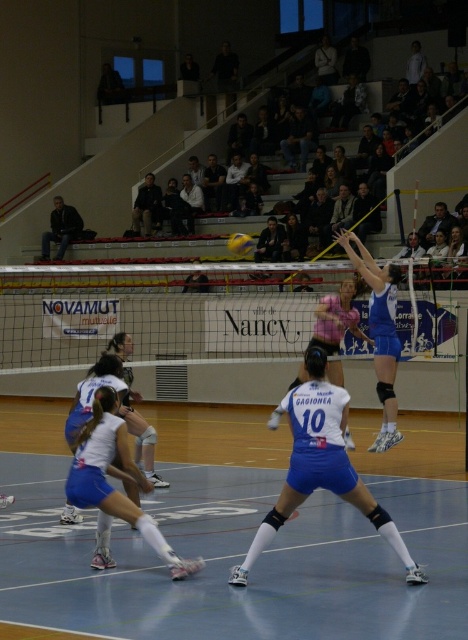
You are a volleyball referee observing the game. The rule states that players must stay at least 2 meters apart during the serve. Based on the image, are the white matte shorts at center and white matte shorts at lower left maintaining the required distance?

The white matte shorts at center and white matte shorts at lower left are 1.52 meters apart, which is less than the required 2 meters. Therefore, they are not maintaining the required distance.

You are a photographer positioned at the edge of the volleyball court. You need to capture a closeup shot of the white matte uniform at center and the white matte shorts at center. Which one will appear larger in your photo?

The white matte uniform at center will appear larger in the photo because it is bigger than the white matte shorts at center.

You are a referee observing the volleyball match. You notice two items at the center of the court. One is labeled as the white matte uniform and the other as the white matte shorts. According to the rules, the uniform must cover the shorts completely. Can you determine if the white matte uniform at center is covering the white matte shorts at center based on their sizes?

The white matte uniform at center might be wider than white matte shorts at center, so it is possible that the uniform is covering the shorts as required by the rules.